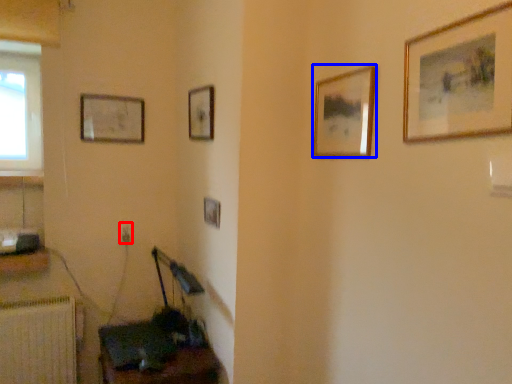
Question: Which point is closer to the camera, electric outlet (highlighted by a red box) or picture frame (highlighted by a blue box)?

Choices:
 (A) electric outlet
 (B) picture frame

Answer: (B)